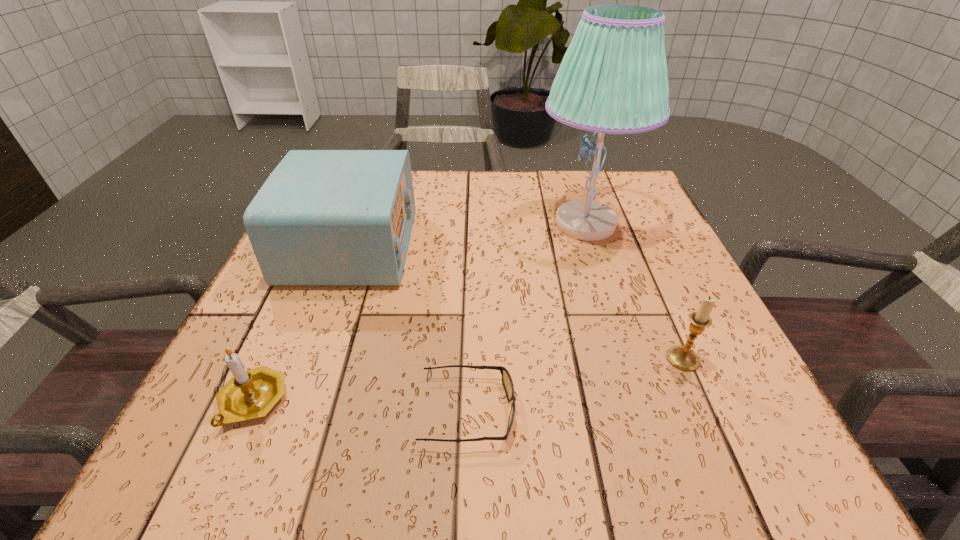
I want to click on free space located on the back of the right candle holder, so click(x=651, y=286).

Identify the location of free location located on the right of the second shortest object. (463, 402).

Locate an element on the screen. The width and height of the screenshot is (960, 540). free space located 0.320m on the front-facing side of the sunglasses is located at coordinates (721, 410).

You are a GUI agent. You are given a task and a screenshot of the screen. Output one action in this format:
    pyautogui.click(x=<x>, y=<y>)
    Task: Click on the lamp at the far edge
    The image size is (960, 540).
    Given the screenshot: What is the action you would take?
    pyautogui.click(x=613, y=79)

What are the coordinates of `radio receiver situated at the far edge` in the screenshot? It's located at (323, 217).

You are a GUI agent. You are given a task and a screenshot of the screen. Output one action in this format:
    pyautogui.click(x=<x>, y=<y>)
    Task: Click on the candle holder positioned at the near edge
    Image resolution: width=960 pixels, height=540 pixels.
    Given the screenshot: What is the action you would take?
    pyautogui.click(x=250, y=394)

At what (x,y) coordinates should I click in order to perform the action: click on sunglasses present at the near edge. Please return your answer as a coordinate pair (x, y). Looking at the image, I should click on (507, 382).

In order to click on radio receiver that is at the left edge in this screenshot , I will do `click(323, 217)`.

Find the location of `candle holder situated at the left edge`. candle holder situated at the left edge is located at coordinates pyautogui.click(x=250, y=394).

Identify the location of lamp present at the right edge. point(613,79).